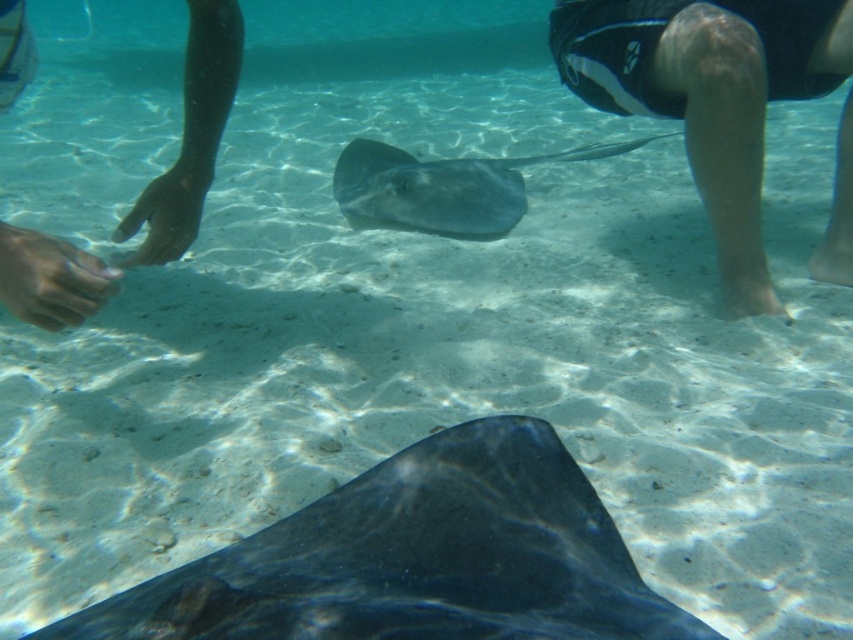
Question: Can you confirm if dark skin hand at left is thinner than smooth gray stingray at center?

Choices:
 (A) yes
 (B) no

Answer: (A)

Question: Which point is closer to the camera?

Choices:
 (A) (74, 630)
 (B) (752, 208)
 (C) (64, 284)
 (D) (473, 173)

Answer: (A)

Question: Which point is farther to the camera?

Choices:
 (A) shiny black stingray at bottom
 (B) smooth gray stingray at center
 (C) dark skin hand at left
 (D) black rubber leg at upper right

Answer: (B)

Question: Is shiny black stingray at bottom positioned at the back of black rubber leg at upper right?

Choices:
 (A) no
 (B) yes

Answer: (A)

Question: Estimate the real-world distances between objects in this image. Which object is farther from the smooth gray stingray at center?

Choices:
 (A) shiny black stingray at bottom
 (B) dark skin hand at left

Answer: (A)

Question: Is black rubber leg at upper right smaller than smooth gray stingray at center?

Choices:
 (A) yes
 (B) no

Answer: (B)